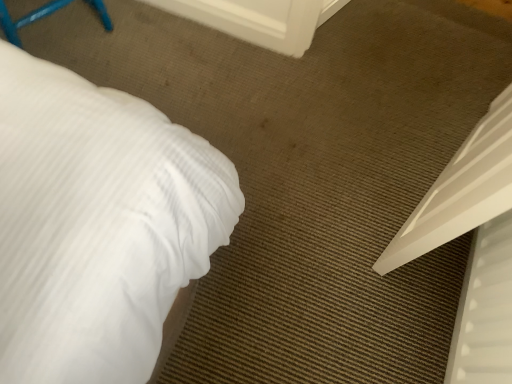
Question: From the image's perspective, is white plastic bed at lower right located beneath white plastic screen door at upper center?

Choices:
 (A) yes
 (B) no

Answer: (A)

Question: Is white plastic bed at lower right outside of white plastic screen door at upper center?

Choices:
 (A) yes
 (B) no

Answer: (A)

Question: Does white plastic bed at lower right have a lesser height compared to white plastic screen door at upper center?

Choices:
 (A) yes
 (B) no

Answer: (B)

Question: Can white plastic screen door at upper center be found inside white plastic bed at lower right?

Choices:
 (A) yes
 (B) no

Answer: (B)

Question: Could you tell me if white plastic bed at lower right is turned towards white plastic screen door at upper center?

Choices:
 (A) yes
 (B) no

Answer: (A)

Question: Does white plastic bed at lower right have a greater height compared to white plastic screen door at upper center?

Choices:
 (A) no
 (B) yes

Answer: (B)

Question: Considering the relative positions of white plastic screen door at upper center and white plastic bed at lower right in the image provided, is white plastic screen door at upper center behind white plastic bed at lower right?

Choices:
 (A) yes
 (B) no

Answer: (A)

Question: Could white plastic bed at lower right be considered to be inside white plastic screen door at upper center?

Choices:
 (A) no
 (B) yes

Answer: (A)

Question: Considering the relative sizes of white plastic screen door at upper center and white plastic bed at lower right in the image provided, is white plastic screen door at upper center wider than white plastic bed at lower right?

Choices:
 (A) no
 (B) yes

Answer: (A)

Question: Does white plastic screen door at upper center appear on the right side of white plastic bed at lower right?

Choices:
 (A) no
 (B) yes

Answer: (A)

Question: From the image's perspective, is white plastic screen door at upper center located above white plastic bed at lower right?

Choices:
 (A) yes
 (B) no

Answer: (A)

Question: Considering the relative sizes of white plastic screen door at upper center and white plastic bed at lower right in the image provided, is white plastic screen door at upper center thinner than white plastic bed at lower right?

Choices:
 (A) yes
 (B) no

Answer: (A)

Question: Choose the correct answer: Is white plastic screen door at upper center inside white plastic bed at lower right or outside it?

Choices:
 (A) outside
 (B) inside

Answer: (A)